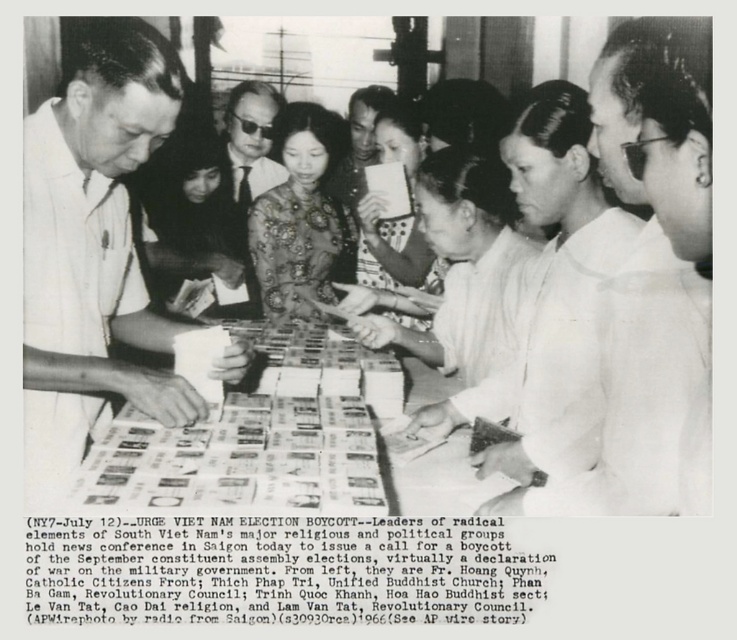
You are an observer standing at the back of the room looking at the scene. You notice the white cloth shirt at right and the white paper at center. Which object is smaller in size?

The white cloth shirt at right is smaller in size compared to the white paper at center.

You are an observer standing at the right side of the table. Which object is closer to you, the white shirt at left or the white paper at center?

The white paper at center is closer to you because it is positioned between the white shirt at left and the right side of the table.